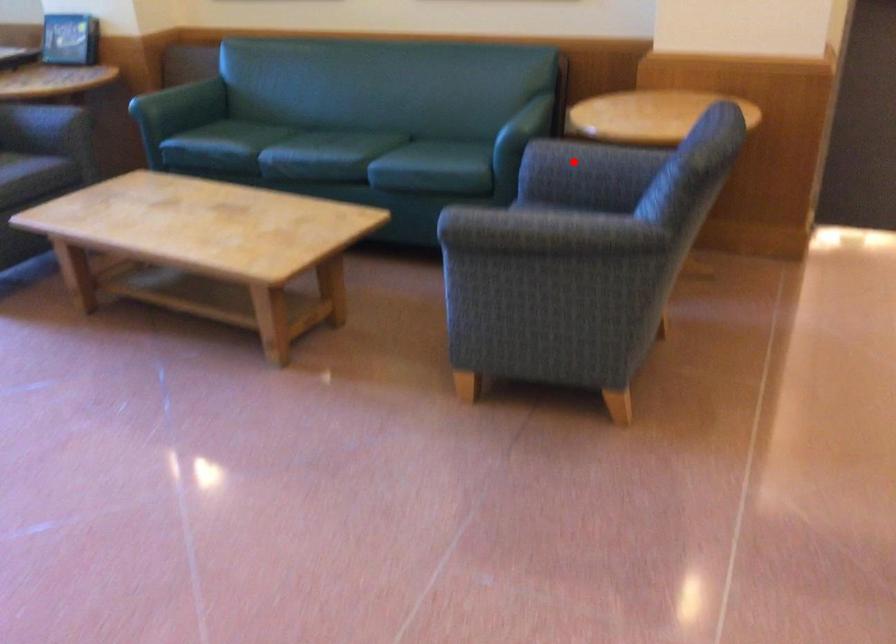
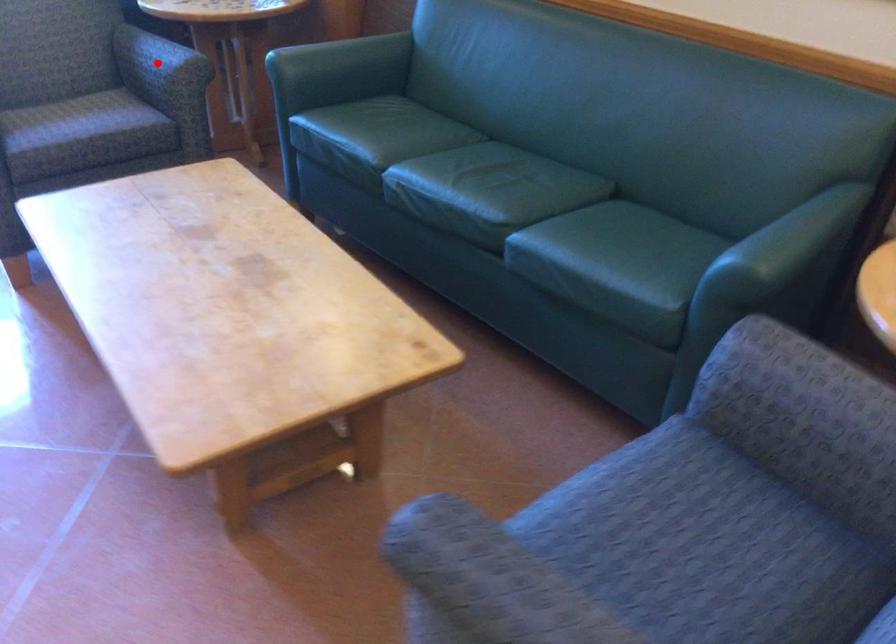
I am providing you with two images of the same scene from different viewpoints. A red point is marked on the first image and another point is marked on the second image. Is the marked point in image1 the same physical position as the marked point in image2?

No